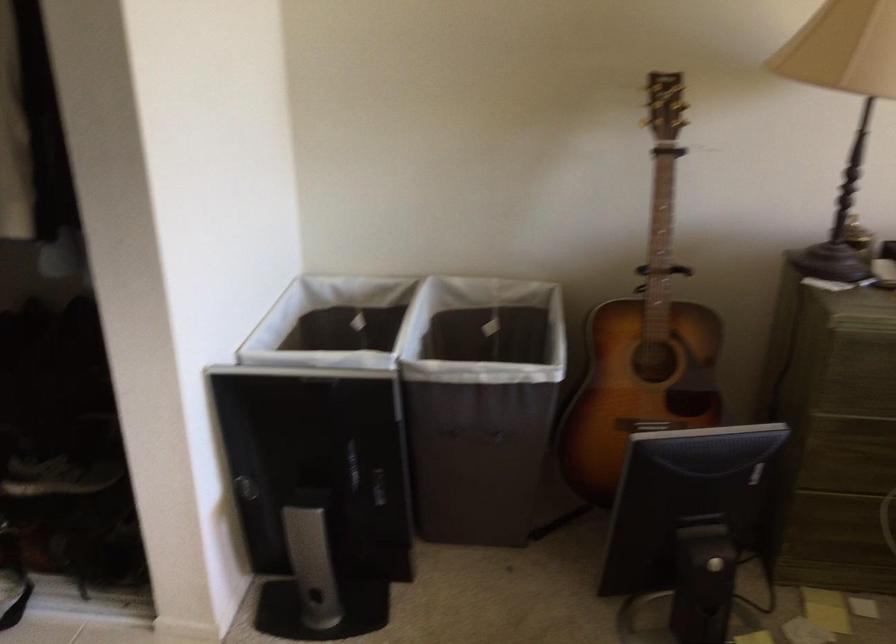
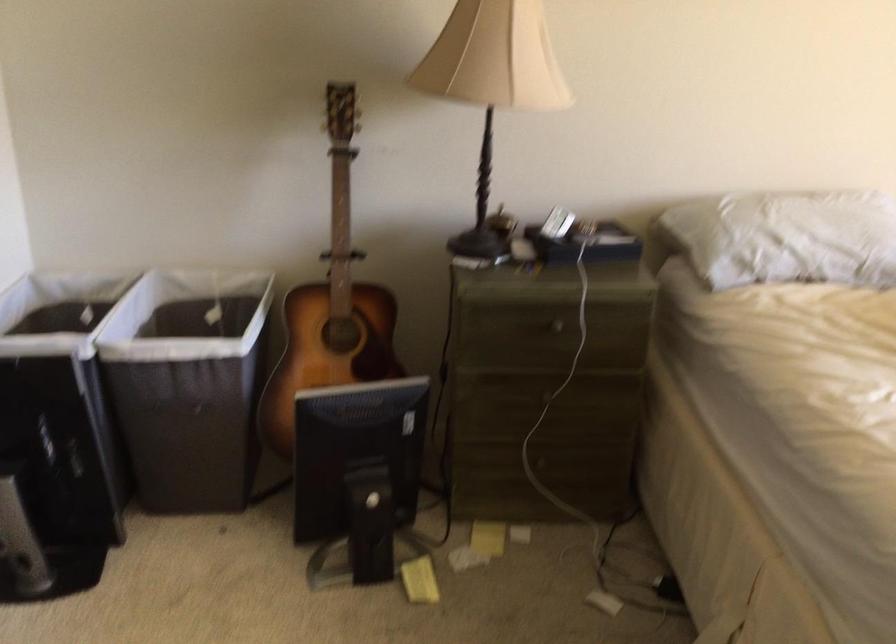
Find the pixel in the second image that matches pixel 471 435 in the first image.

(181, 406)